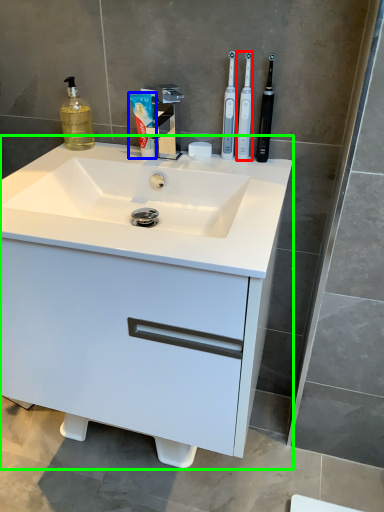
Question: Which is nearer to the toothbrush (highlighted by a red box)? toothpaste (highlighted by a blue box) or bathroom cabinet (highlighted by a green box).

Choices:
 (A) toothpaste
 (B) bathroom cabinet

Answer: (A)